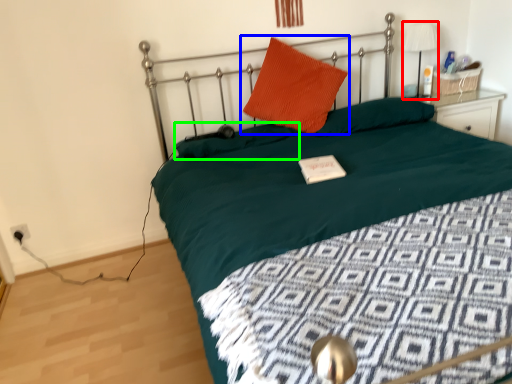
Question: Which object is the farthest from table lamp (highlighted by a red box)? Choose among these: pillow (highlighted by a blue box) or pillow (highlighted by a green box).

Choices:
 (A) pillow
 (B) pillow

Answer: (B)